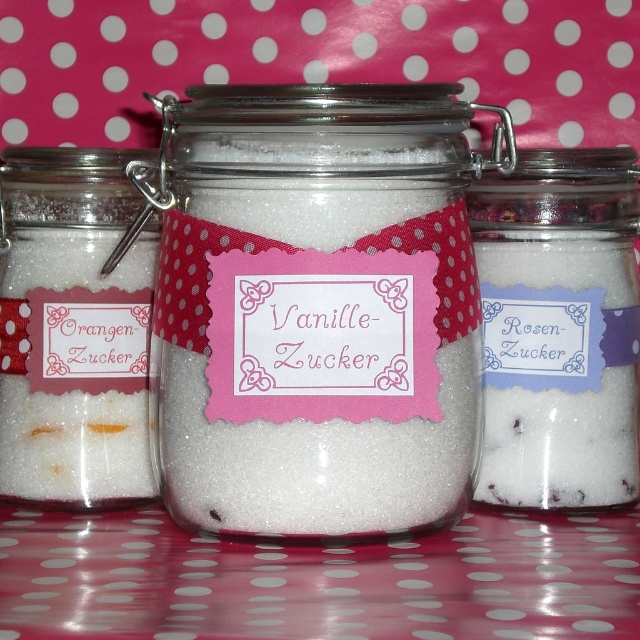
Can you confirm if pink polka dot fabric at center is positioned below white sugar at center?

Correct, pink polka dot fabric at center is located below white sugar at center.

Between pink polka dot fabric at center and white sugar at center, which one has more height?

white sugar at center

Between point (609, 547) and point (541, 176), which one is positioned in front?

Positioned in front is point (609, 547).

Locate an element on the screen. The image size is (640, 640). pink polka dot fabric at center is located at coordinates (317, 579).

Can you confirm if white matte sugar at center is thinner than pink polka dot fabric at center?

Yes, white matte sugar at center is thinner than pink polka dot fabric at center.

Who is more distant from viewer, (186, 372) or (500, 545)?

A: Positioned behind is point (500, 545).

The width and height of the screenshot is (640, 640). I want to click on white matte sugar at center, so click(317, 308).

Can you confirm if white matte sugar at center is smaller than white sugar at center?

Actually, white matte sugar at center might be larger than white sugar at center.

This screenshot has height=640, width=640. Identify the location of white matte sugar at center. (317, 308).